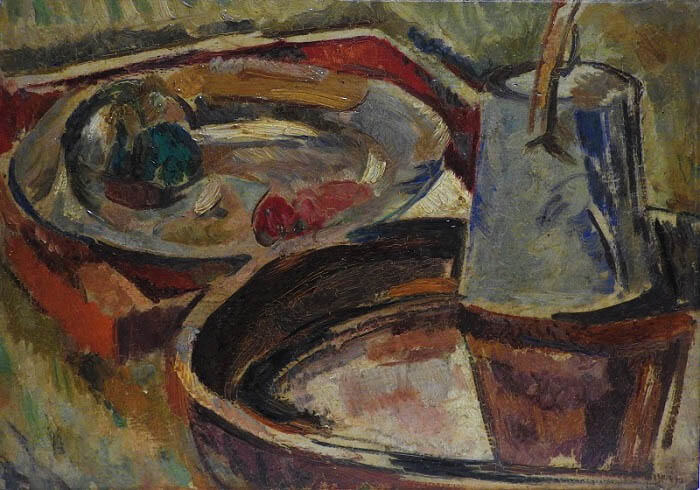
I want to click on wooden tray, so click(x=126, y=319).